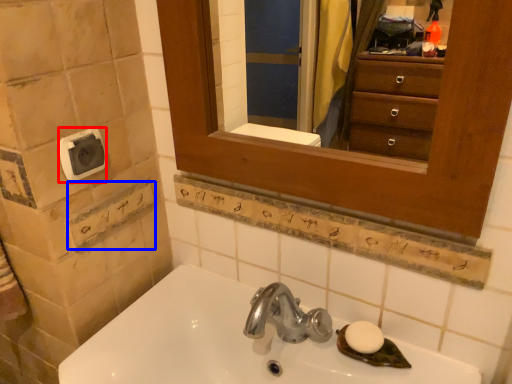
Question: Which of the following is the farthest to the observer, towel bar (highlighted by a red box) or square (highlighted by a blue box)?

Choices:
 (A) towel bar
 (B) square

Answer: (B)